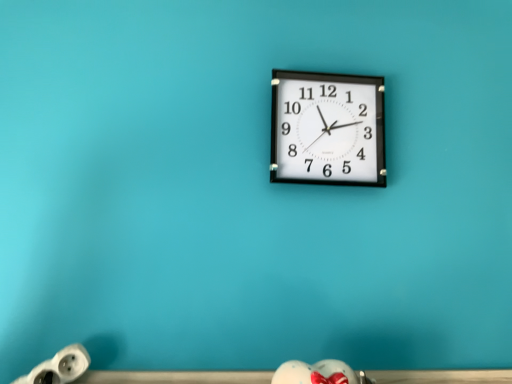
Question: Does black plastic wall clock at center have a greater width compared to white plastic plug at lower left?

Choices:
 (A) yes
 (B) no

Answer: (B)

Question: Is black plastic wall clock at center closer to the viewer compared to white plastic plug at lower left?

Choices:
 (A) yes
 (B) no

Answer: (B)

Question: Is black plastic wall clock at center looking in the opposite direction of white plastic plug at lower left?

Choices:
 (A) no
 (B) yes

Answer: (A)

Question: Does black plastic wall clock at center appear on the left side of white plastic plug at lower left?

Choices:
 (A) yes
 (B) no

Answer: (B)

Question: From a real-world perspective, is black plastic wall clock at center below white plastic plug at lower left?

Choices:
 (A) no
 (B) yes

Answer: (A)

Question: Can you confirm if black plastic wall clock at center is bigger than white plastic plug at lower left?

Choices:
 (A) no
 (B) yes

Answer: (B)

Question: From a real-world perspective, is white plastic plug at lower left on top of black plastic wall clock at center?

Choices:
 (A) yes
 (B) no

Answer: (B)

Question: Can you confirm if white plastic plug at lower left is taller than black plastic wall clock at center?

Choices:
 (A) yes
 (B) no

Answer: (B)

Question: Is white plastic plug at lower left wider than black plastic wall clock at center?

Choices:
 (A) yes
 (B) no

Answer: (A)

Question: Is black plastic wall clock at center surrounded by white plastic plug at lower left?

Choices:
 (A) yes
 (B) no

Answer: (B)

Question: From the image's perspective, is white plastic plug at lower left below black plastic wall clock at center?

Choices:
 (A) yes
 (B) no

Answer: (A)

Question: Is white plastic plug at lower left beside black plastic wall clock at center?

Choices:
 (A) no
 (B) yes

Answer: (A)

Question: Considering their positions, is black plastic wall clock at center located in front of or behind white plastic plug at lower left?

Choices:
 (A) front
 (B) behind

Answer: (B)